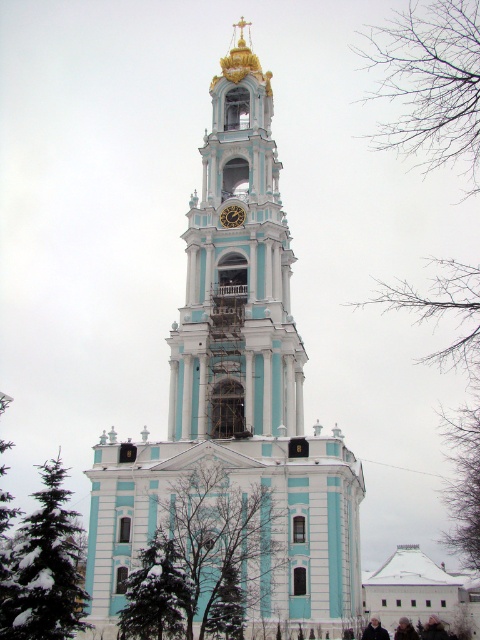
Does light blue stone bell tower at center have a lesser height compared to gold metallic clock at center?

No, light blue stone bell tower at center is not shorter than gold metallic clock at center.

Who is positioned more to the right, light blue stone bell tower at center or gold metallic clock at center?

gold metallic clock at center

Does point (276, 164) come closer to viewer compared to point (222, 216)?

No, (276, 164) is behind (222, 216).

This screenshot has width=480, height=640. In order to click on light blue stone bell tower at center in this screenshot , I will do `click(237, 276)`.

Does teal glossy tower at center have a greater width compared to gold metallic clock at center?

Correct, the width of teal glossy tower at center exceeds that of gold metallic clock at center.

Can you confirm if teal glossy tower at center is positioned above gold metallic clock at center?

No.

Is point (217, 385) behind point (230, 225)?

No, (217, 385) is closer to viewer.

This screenshot has width=480, height=640. I want to click on teal glossy tower at center, so click(237, 396).

Between point (452, 92) and point (228, 205), which one is positioned in front?

Point (452, 92) is in front.

Which of these two, bare branches at lower right or gold metallic clock at center, stands shorter?

Standing shorter between the two is gold metallic clock at center.

Locate an element on the screen. bare branches at lower right is located at coordinates [432, 83].